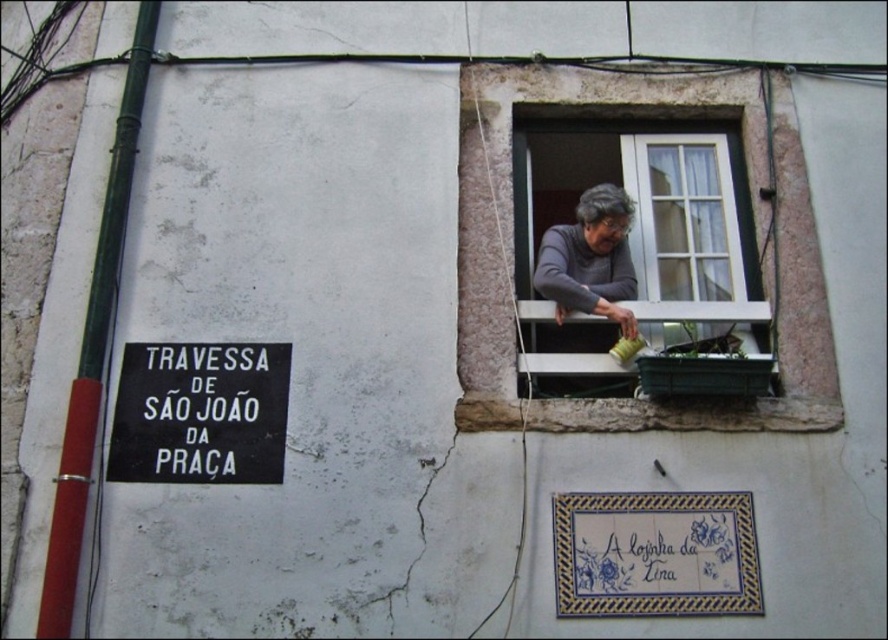
You are standing in front of the building wall and want to look up to see the white wooden window at upper right. Will you have to look upwards or downwards from the black matte sign at lower left to see it?

The white wooden window at upper right is above the black matte sign at lower left, so you will have to look upwards from the sign to see the window.

You are a delivery person trying to reach the door of the building. You see the black matte sign at lower left and the gray fabric at window. Which object is closer to the door?

The black matte sign at lower left and gray fabric at window are 5.31 feet apart from each other. Since the sign is at the lower left and the fabric is at the window, which is to the right of the sign, the black matte sign at lower left is closer to the door.

You are a delivery person trying to determine the best spot to park your vehicle near the black matte sign at lower left and the gray fabric at window. Since you need to choose the narrower space to avoid blocking pedestrian pathways, which object should you park next to?

The black matte sign at lower left occupies less space than the gray fabric at window, so you should park next to the black matte sign at lower left to avoid blocking pedestrian pathways.